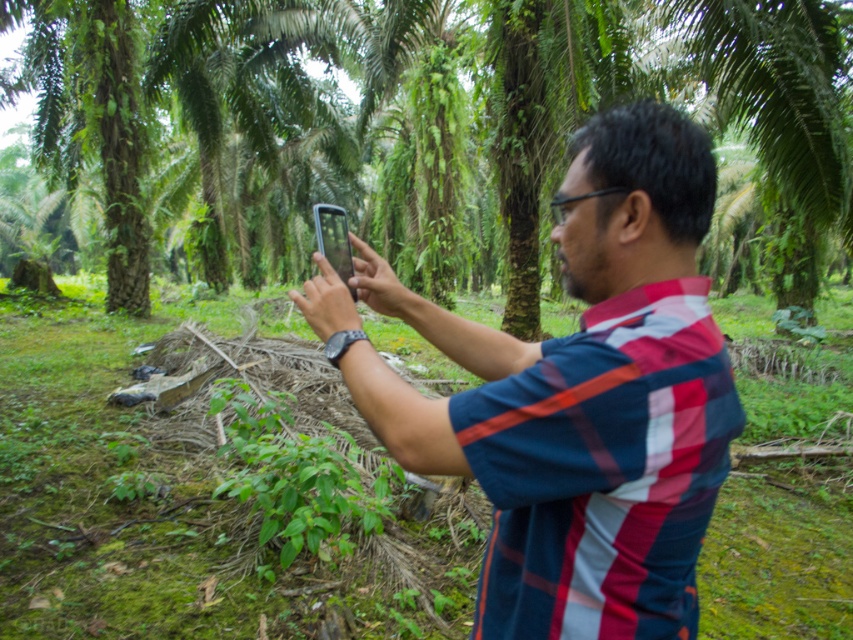
Is point (144, 253) farther from camera compared to point (508, 497)?

Yes.

Is point (200, 48) positioned in front of point (558, 200)?

No, it is not.

Where is `green leafy tree at center`? This screenshot has width=853, height=640. green leafy tree at center is located at coordinates (425, 129).